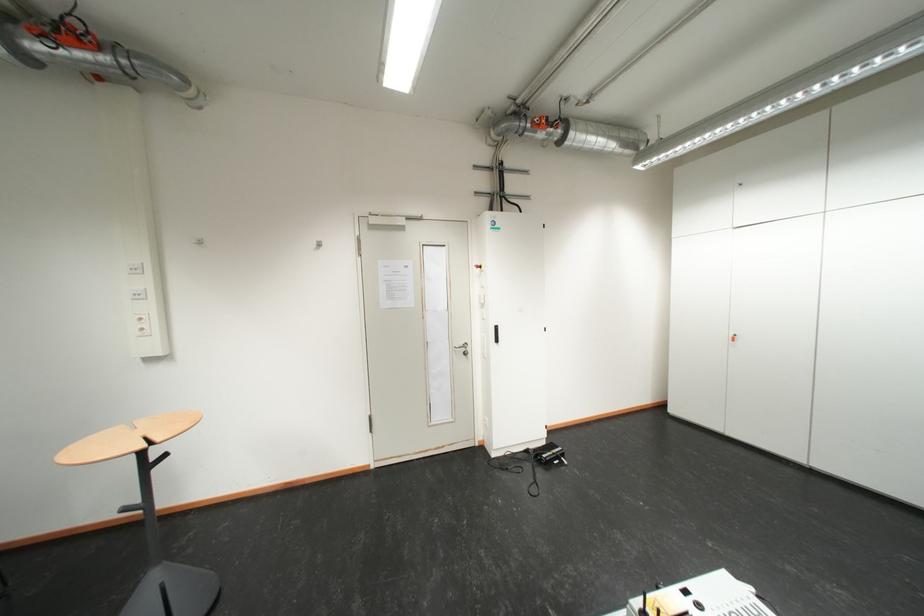
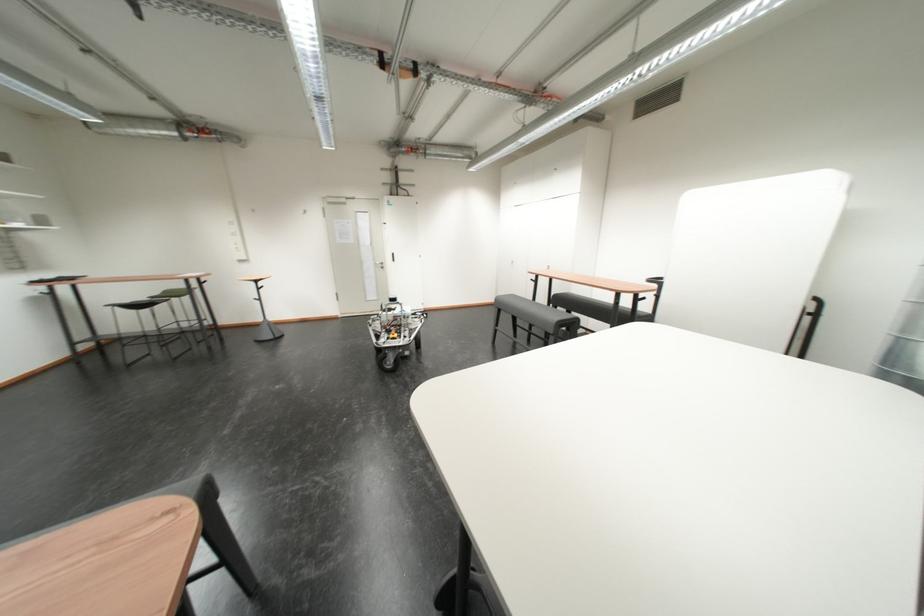
In a continuous first-person perspective shot, in which direction is the camera moving?

The cameraman moved toward right, backward.